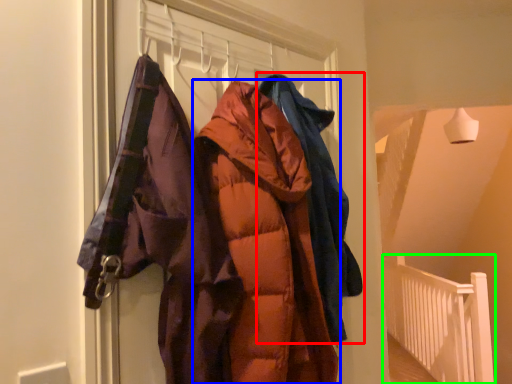
Question: Considering the real-world distances, which object is closest to jacket (highlighted by a red box)? jacket (highlighted by a blue box) or balustrade (highlighted by a green box).

Choices:
 (A) jacket
 (B) balustrade

Answer: (A)